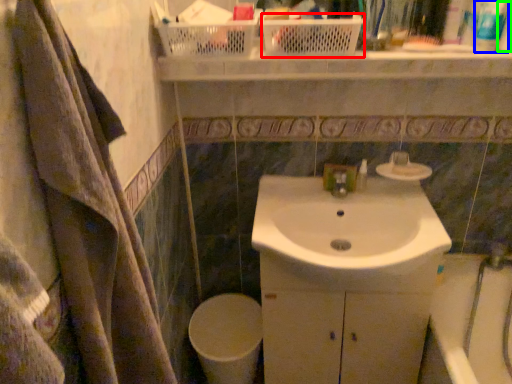
Question: Which object is positioned farthest from basket (highlighted by a red box)? Select from toiletry (highlighted by a blue box) and toiletry (highlighted by a green box).

Choices:
 (A) toiletry
 (B) toiletry

Answer: (B)